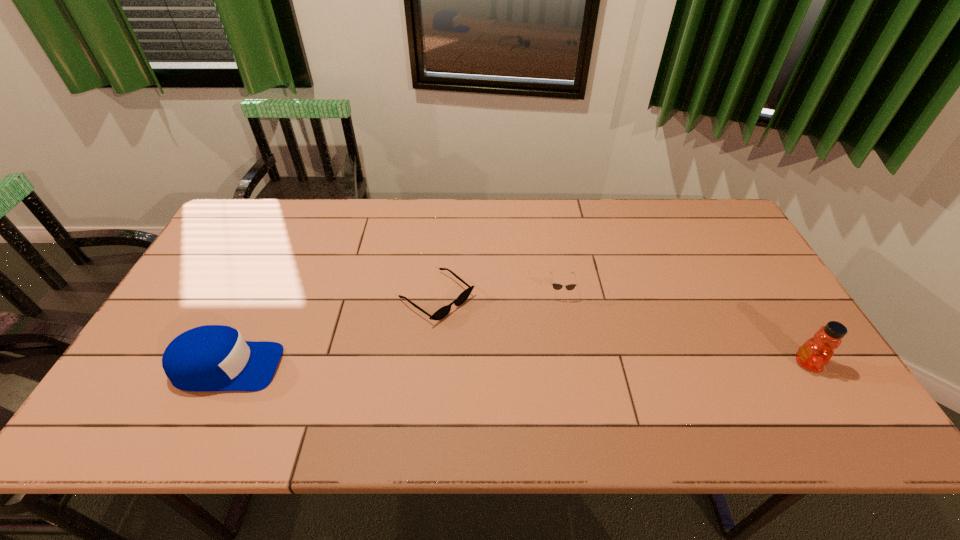
Where is `the third shortest object`? the third shortest object is located at coordinates (207, 358).

Find the location of a particular element. This screenshot has width=960, height=540. baseball cap is located at coordinates (207, 358).

Where is `the tallest object`? This screenshot has height=540, width=960. the tallest object is located at coordinates (816, 352).

Identify the location of the rightmost object. The height and width of the screenshot is (540, 960). (816, 352).

Where is `the third tallest object`? The width and height of the screenshot is (960, 540). the third tallest object is located at coordinates (556, 286).

Locate an element on the screen. The image size is (960, 540). the second object from right to left is located at coordinates (556, 286).

Identify the location of the third object from right to left. (443, 311).

Locate an element on the screen. This screenshot has width=960, height=540. the left sunglasses is located at coordinates (443, 311).

You are a GUI agent. You are given a task and a screenshot of the screen. Output one action in this format:
    pyautogui.click(x=<x>, y=<y>)
    Task: Click on the free space located 0.320m on the front-facing side of the second tallest object
    The height and width of the screenshot is (540, 960).
    Given the screenshot: What is the action you would take?
    pyautogui.click(x=410, y=367)

The width and height of the screenshot is (960, 540). In order to click on free space located in front of the lenses of the second shortest object in this screenshot , I will do `click(564, 350)`.